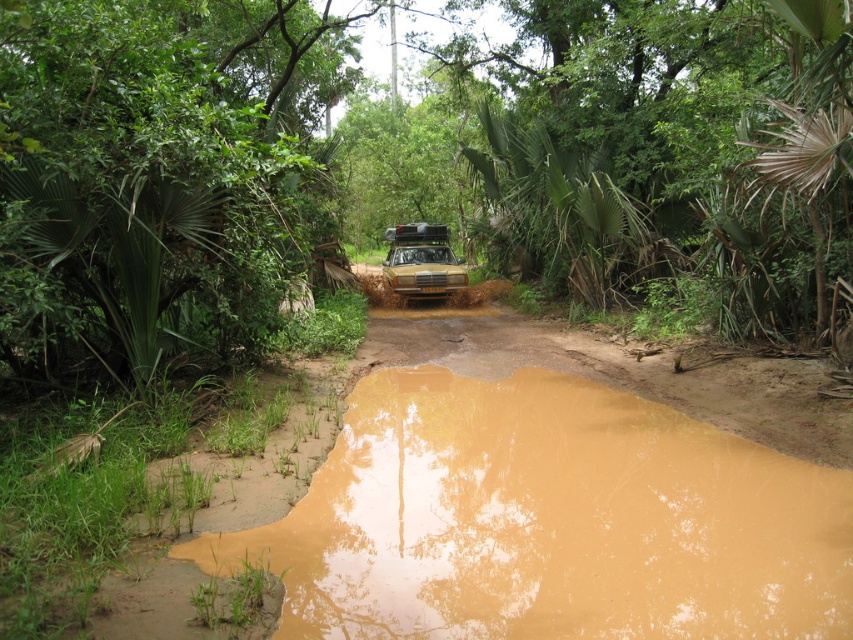
Question: Does brown muddy water at lower center have a greater width compared to yellow matte car at center?

Choices:
 (A) yes
 (B) no

Answer: (A)

Question: Among these points, which one is farthest from the camera?

Choices:
 (A) (44, 196)
 (B) (643, 513)

Answer: (A)

Question: Does brown muddy water at lower center have a larger size compared to yellow matte car at center?

Choices:
 (A) no
 (B) yes

Answer: (A)

Question: Can you confirm if green leafy bush at upper left is smaller than yellow matte car at center?

Choices:
 (A) no
 (B) yes

Answer: (A)

Question: Which of the following is the closest to the observer?

Choices:
 (A) (416, 531)
 (B) (201, 13)
 (C) (409, 253)

Answer: (A)

Question: Among these objects, which one is nearest to the camera?

Choices:
 (A) brown muddy water at lower center
 (B) yellow matte car at center

Answer: (A)